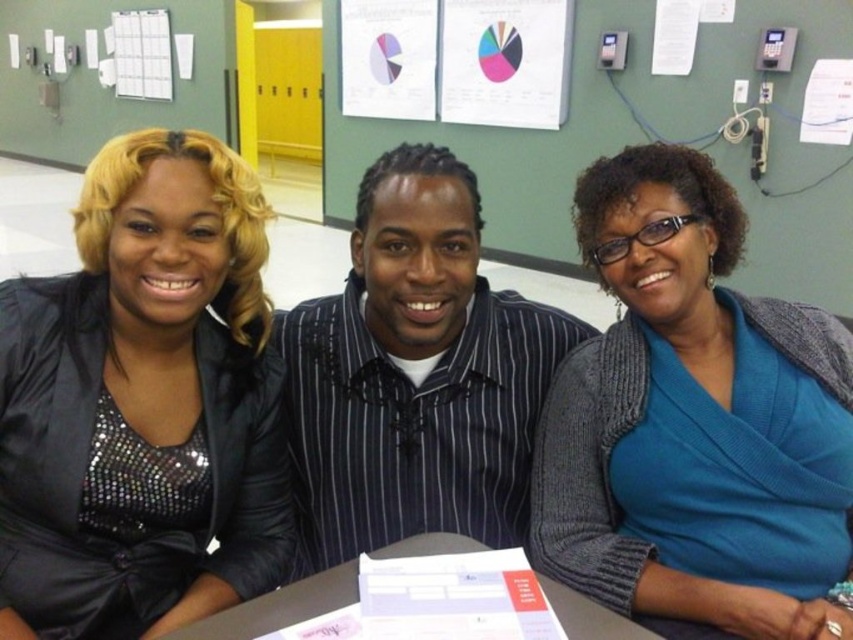
Based on the scene description, can you determine which of the two items, the blue knit sweater at center or the black pinstripe shirt at center, is positioned higher up?

The blue knit sweater at center is positioned higher up because it is described as being above the black pinstripe shirt at center.

Based on the scene description, where is the blue knit sweater at center positioned relative to the other objects?

The blue knit sweater at center is located at point 0.655 on the x and 0.810 on the y axis.